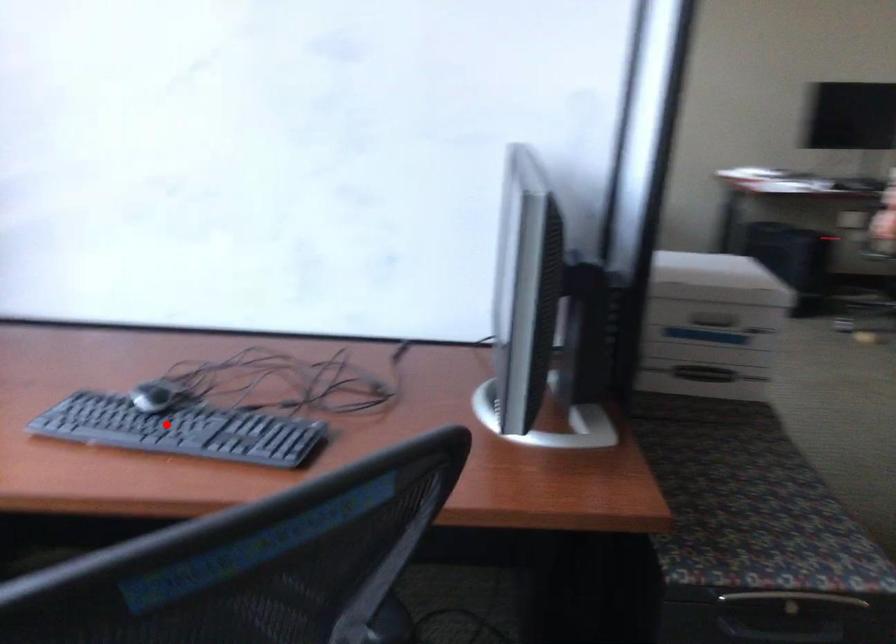
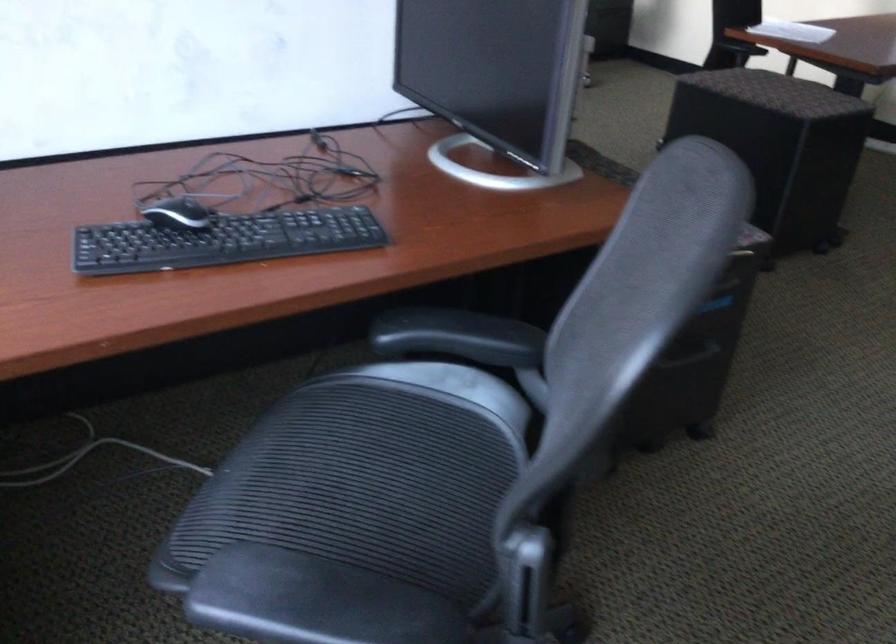
Locate, in the second image, the point that corresponds to the highlighted location in the first image.

(222, 240)